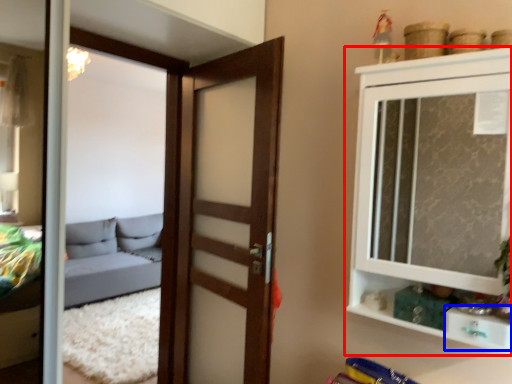
Question: Which of the following is the closest to the observer, cupboard (highlighted by a red box) or drawer (highlighted by a blue box)?

Choices:
 (A) cupboard
 (B) drawer

Answer: (A)